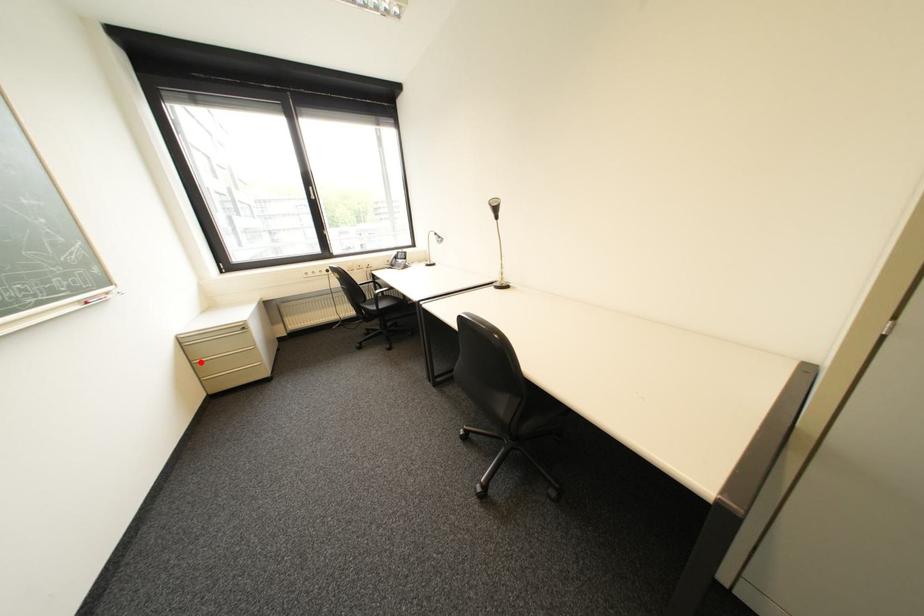
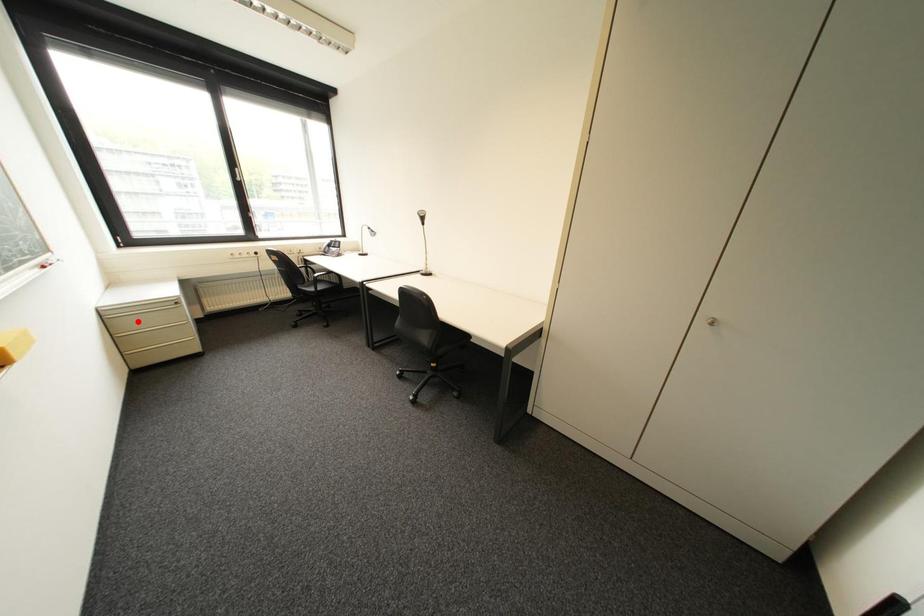
I am providing you with two images of the same scene from different viewpoints. A red point is marked on the first image and another point is marked on the second image. Is the marked point in image1 the same physical position as the marked point in image2?

No